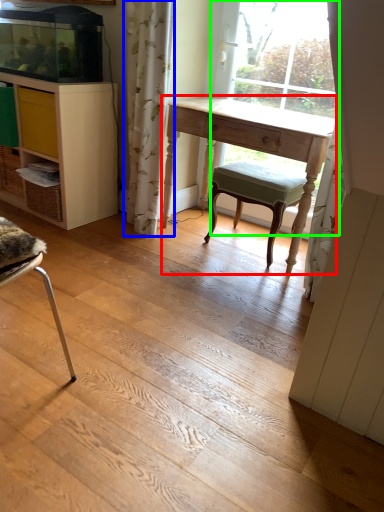
Question: Based on their relative distances, which object is farther from desk (highlighted by a red box)? Choose from curtain (highlighted by a blue box) and bay window (highlighted by a green box).

Choices:
 (A) curtain
 (B) bay window

Answer: (B)